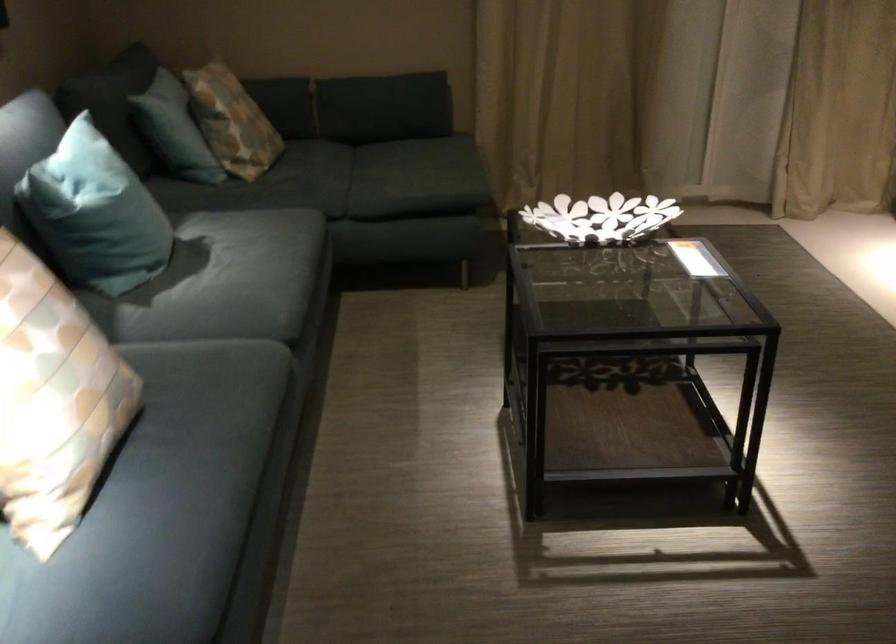
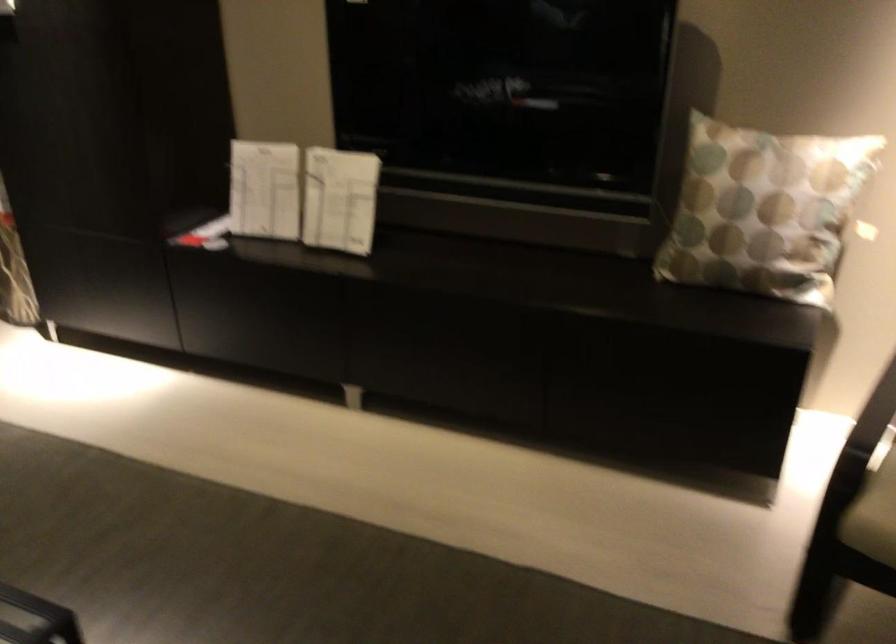
Question: The first image is from the beginning of the video and the second image is from the end. How did the camera likely rotate when shooting the video?

Choices:
 (A) Left
 (B) Right
 (C) Up
 (D) Down

Answer: (B)